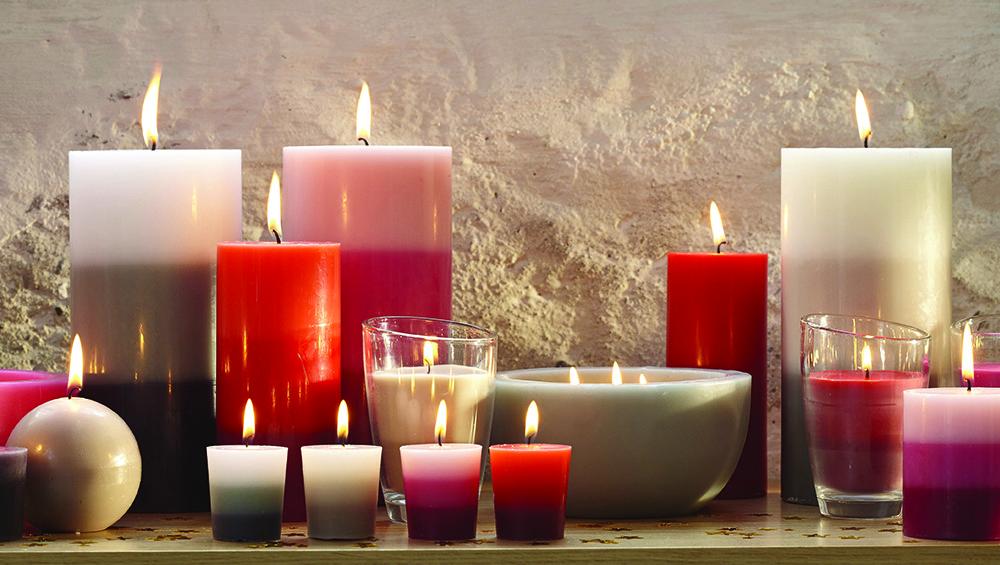
I want to click on votive candle, so click(511, 503), click(436, 478), click(364, 477), click(261, 480), click(16, 468).